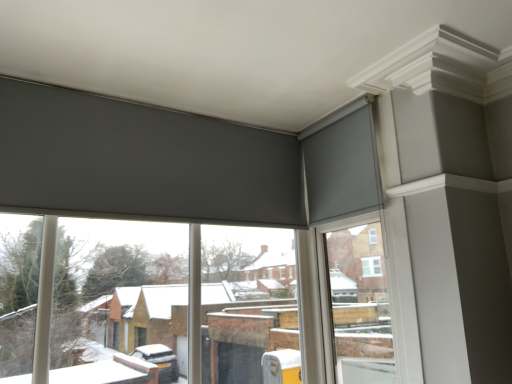
Question: Does matte gray curtain at upper right appear on the right side of matte gray roller blinds at upper center?

Choices:
 (A) yes
 (B) no

Answer: (A)

Question: From a real-world perspective, is matte gray curtain at upper right positioned under matte gray roller blinds at upper center based on gravity?

Choices:
 (A) yes
 (B) no

Answer: (B)

Question: Considering the relative sizes of matte gray curtain at upper right and matte gray roller blinds at upper center in the image provided, is matte gray curtain at upper right smaller than matte gray roller blinds at upper center?

Choices:
 (A) no
 (B) yes

Answer: (B)

Question: Are matte gray curtain at upper right and matte gray roller blinds at upper center far apart?

Choices:
 (A) yes
 (B) no

Answer: (B)

Question: Can you confirm if matte gray curtain at upper right is shorter than matte gray roller blinds at upper center?

Choices:
 (A) yes
 (B) no

Answer: (A)

Question: In terms of size, does matte gray roller blinds at upper center appear bigger or smaller than smooth white window frame at upper right?

Choices:
 (A) big
 (B) small

Answer: (A)

Question: In the image, is matte gray roller blinds at upper center positioned in front of or behind smooth white window frame at upper right?

Choices:
 (A) front
 (B) behind

Answer: (A)

Question: Based on their positions, is matte gray roller blinds at upper center located to the left or right of smooth white window frame at upper right?

Choices:
 (A) left
 (B) right

Answer: (A)

Question: Considering the positions of point (42, 319) and point (325, 360), is point (42, 319) closer or farther from the camera than point (325, 360)?

Choices:
 (A) closer
 (B) farther

Answer: (A)

Question: Considering the positions of point (339, 150) and point (370, 117), is point (339, 150) closer or farther from the camera than point (370, 117)?

Choices:
 (A) closer
 (B) farther

Answer: (B)

Question: From a real-world perspective, is smooth white window frame at upper right physically located above or below matte gray curtain at upper right?

Choices:
 (A) below
 (B) above

Answer: (A)

Question: From the image's perspective, is smooth white window frame at upper right located above or below matte gray curtain at upper right?

Choices:
 (A) above
 (B) below

Answer: (B)

Question: Considering the positions of smooth white window frame at upper right and matte gray curtain at upper right in the image, is smooth white window frame at upper right taller or shorter than matte gray curtain at upper right?

Choices:
 (A) short
 (B) tall

Answer: (B)

Question: Is smooth white window frame at upper right spatially inside matte gray roller blinds at upper center, or outside of it?

Choices:
 (A) outside
 (B) inside

Answer: (A)

Question: Is point (325, 340) positioned closer to the camera than point (145, 344)?

Choices:
 (A) closer
 (B) farther

Answer: (B)